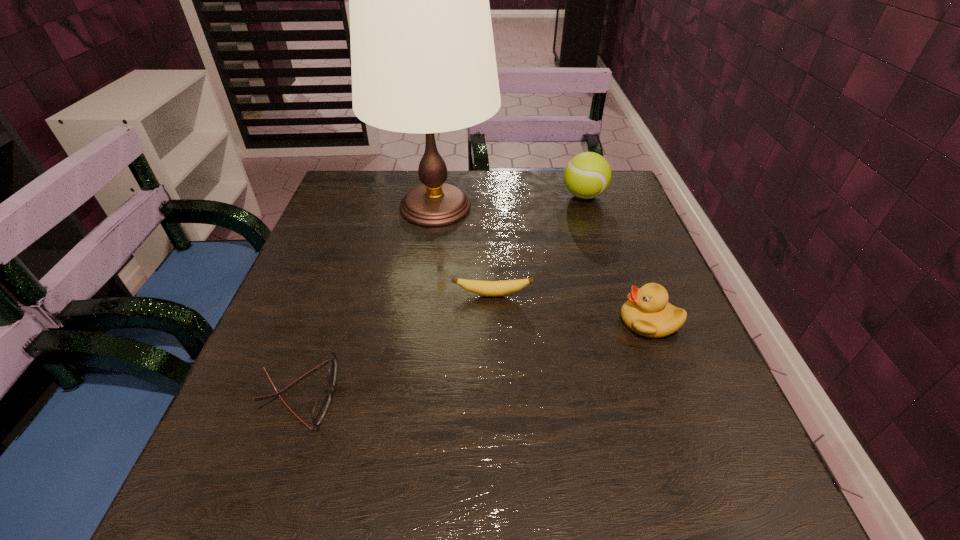
The height and width of the screenshot is (540, 960). I want to click on object located at the far right corner, so click(587, 175).

Find the location of a particular element. Image resolution: width=960 pixels, height=540 pixels. vacant area at the far edge of the desktop is located at coordinates (470, 184).

Locate an element on the screen. vacant space at the near edge of the desktop is located at coordinates (553, 525).

At what (x,y) coordinates should I click in order to perform the action: click on vacant space at the left edge of the desktop. Please return your answer as a coordinate pair (x, y). Looking at the image, I should click on (339, 360).

You are a GUI agent. You are given a task and a screenshot of the screen. Output one action in this format:
    pyautogui.click(x=<x>, y=<y>)
    Task: Click on the vacant space at the right edge of the desktop
    This screenshot has width=960, height=540.
    Given the screenshot: What is the action you would take?
    pyautogui.click(x=668, y=427)

This screenshot has width=960, height=540. I want to click on vacant area at the far left corner, so coord(345,187).

Locate an element on the screen. This screenshot has height=540, width=960. vacant space at the near left corner of the desktop is located at coordinates (265, 529).

The image size is (960, 540). Identify the location of vacant space at the far right corner of the desktop. (612, 207).

This screenshot has height=540, width=960. I want to click on free spot between the spectacles and the third tallest object, so click(474, 357).

This screenshot has height=540, width=960. In order to click on free space that is in between the tennis ball and the third tallest object in this screenshot , I will do `click(616, 259)`.